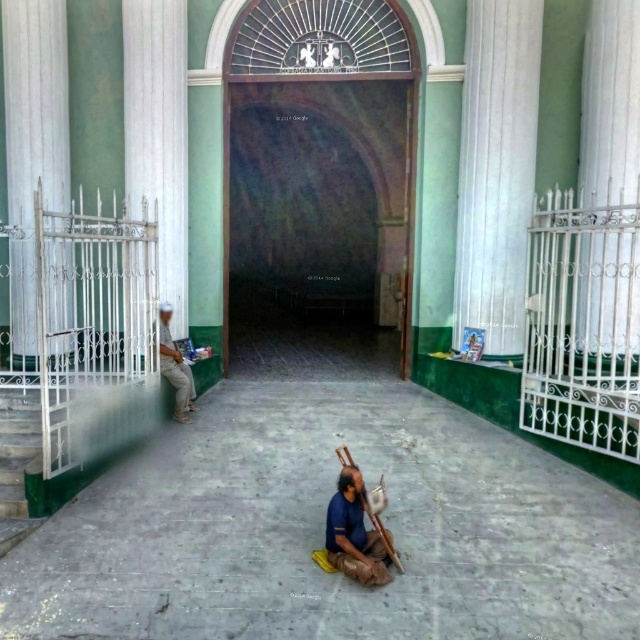
You are standing at the entrance of the historical building and want to place a small decorative item between the two points, point (515, 157) and point (48, 93). Which point should the item be closer to in order to be visible from the entrance?

The item should be closer to point (48, 93) because it is farther from the viewer, making the item more visible from the entrance.

You are standing at the entrance of the historical building and want to place a 25 feet long decorative banner that stretches from the white glossy pillar at left to the right side of the entrance. Will the banner be long enough to reach the right side?

The distance between the white glossy pillar at left and the right side of the entrance is 27.04 feet. Since the banner is only 25 feet long, it will be 2.04 feet short and won not reach the right side.